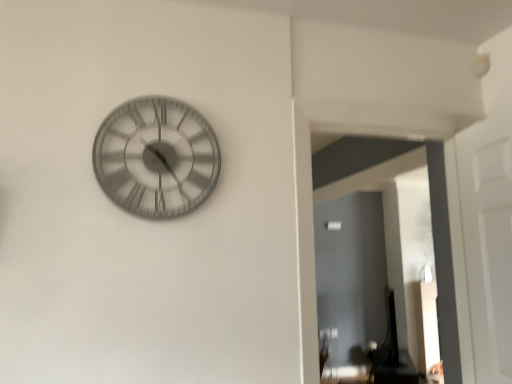
Question: Is metallic silver clock at upper left inside or outside of transparent glass door at right?

Choices:
 (A) outside
 (B) inside

Answer: (A)

Question: From the image's perspective, is metallic silver clock at upper left above or below transparent glass door at right?

Choices:
 (A) below
 (B) above

Answer: (B)

Question: From a real-world perspective, is metallic silver clock at upper left physically located above or below transparent glass door at right?

Choices:
 (A) above
 (B) below

Answer: (A)

Question: From the image's perspective, is transparent glass door at right above or below metallic silver clock at upper left?

Choices:
 (A) below
 (B) above

Answer: (A)

Question: From a real-world perspective, is transparent glass door at right physically located above or below metallic silver clock at upper left?

Choices:
 (A) below
 (B) above

Answer: (A)

Question: Is transparent glass door at right bigger or smaller than metallic silver clock at upper left?

Choices:
 (A) big
 (B) small

Answer: (A)

Question: Choose the correct answer: Is transparent glass door at right inside metallic silver clock at upper left or outside it?

Choices:
 (A) outside
 (B) inside

Answer: (A)